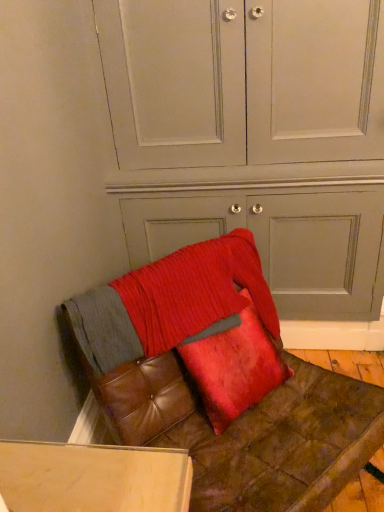
Locate an element on the screen. This screenshot has height=512, width=384. leather cushion at lower right is located at coordinates (243, 432).

Describe the element at coordinates (243, 432) in the screenshot. I see `leather cushion at lower right` at that location.

Image resolution: width=384 pixels, height=512 pixels. What do you see at coordinates (257, 144) in the screenshot?
I see `matte gray dresser at center` at bounding box center [257, 144].

Identify the location of leather cushion at lower right. (243, 432).

Is matte gray dresser at center positioned with its back to velvet red pillow at center?

Yes, matte gray dresser at center's orientation is away from velvet red pillow at center.

Considering the positions of objects matte gray dresser at center and velvet red pillow at center in the image provided, who is more to the left, matte gray dresser at center or velvet red pillow at center?

Positioned to the left is velvet red pillow at center.

Is matte gray dresser at center thinner than velvet red pillow at center?

No, matte gray dresser at center is not thinner than velvet red pillow at center.

Choose the correct answer: Is velvet red pillow at center inside matte gray dresser at center or outside it?

velvet red pillow at center is spatially situated outside matte gray dresser at center.

From a real-world perspective, is velvet red pillow at center beneath matte gray dresser at center?

Correct, in the physical world, velvet red pillow at center is lower than matte gray dresser at center.

Is velvet red pillow at center far from matte gray dresser at center?

No, velvet red pillow at center is in close proximity to matte gray dresser at center.

How many degrees apart are the facing directions of velvet red pillow at center and matte gray dresser at center?

The facing directions of velvet red pillow at center and matte gray dresser at center are 46 degrees apart.

How many degrees apart are the facing directions of matte gray dresser at center and leather cushion at lower right?

There is a 46-degree angle between the facing directions of matte gray dresser at center and leather cushion at lower right.

In the scene shown: Is matte gray dresser at center smaller than leather cushion at lower right?

Actually, matte gray dresser at center might be larger than leather cushion at lower right.

Consider the image. Is matte gray dresser at center further to camera compared to leather cushion at lower right?

Yes, matte gray dresser at center is further from the viewer.

From a real-world perspective, which is physically below, matte gray dresser at center or leather cushion at lower right?

From a 3D spatial view, leather cushion at lower right is below.

From the image's perspective, is velvet red pillow at center located above leather cushion at lower right?

Yes, from the image's perspective, velvet red pillow at center is on top of leather cushion at lower right.

Which point is more forward, (181, 352) or (277, 477)?

The point (277, 477) is closer.

Is velvet red pillow at center completely or partially outside of leather cushion at lower right?

No, velvet red pillow at center is not outside of leather cushion at lower right.

From the image's perspective, is leather cushion at lower right under matte gray dresser at center?

Correct, leather cushion at lower right appears lower than matte gray dresser at center in the image.

Could you tell me if leather cushion at lower right is turned towards matte gray dresser at center?

No, leather cushion at lower right does not turn towards matte gray dresser at center.

This screenshot has width=384, height=512. Identify the location of dresser that is behind the leather cushion at lower right. (257, 144).

Is leather cushion at lower right further to the viewer compared to velvet red pillow at center?

No, leather cushion at lower right is closer to the camera.

Does leather cushion at lower right turn towards velvet red pillow at center?

Yes, leather cushion at lower right is oriented towards velvet red pillow at center.

Considering the sizes of objects leather cushion at lower right and velvet red pillow at center in the image provided, who is thinner, leather cushion at lower right or velvet red pillow at center?

With smaller width is velvet red pillow at center.

In the image, there is a matte gray dresser at center. Where is `pillow below it (from the image's perspective)`? This screenshot has width=384, height=512. pillow below it (from the image's perspective) is located at coordinates (234, 364).

Image resolution: width=384 pixels, height=512 pixels. In order to click on pillow on the left of matte gray dresser at center in this screenshot , I will do `click(234, 364)`.

Looking at the image, which one is located further to leather cushion at lower right, matte gray dresser at center or velvet red pillow at center?

matte gray dresser at center is further to leather cushion at lower right.

Considering their positions, is velvet red pillow at center positioned further to leather cushion at lower right than matte gray dresser at center?

matte gray dresser at center lies further to leather cushion at lower right than the other object.

From the image, which object appears to be nearer to velvet red pillow at center, matte gray dresser at center or leather cushion at lower right?

leather cushion at lower right.

Considering their positions, is leather cushion at lower right positioned closer to velvet red pillow at center than matte gray dresser at center?

leather cushion at lower right is positioned closer to the anchor velvet red pillow at center.

Estimate the real-world distances between objects in this image. Which object is further from matte gray dresser at center, leather cushion at lower right or velvet red pillow at center?

Based on the image, leather cushion at lower right appears to be further to matte gray dresser at center.

In the scene shown: Which object lies nearer to the anchor point matte gray dresser at center, velvet red pillow at center or leather cushion at lower right?

Based on the image, velvet red pillow at center appears to be nearer to matte gray dresser at center.

The height and width of the screenshot is (512, 384). I want to click on pillow between matte gray dresser at center and leather cushion at lower right from top to bottom, so click(x=234, y=364).